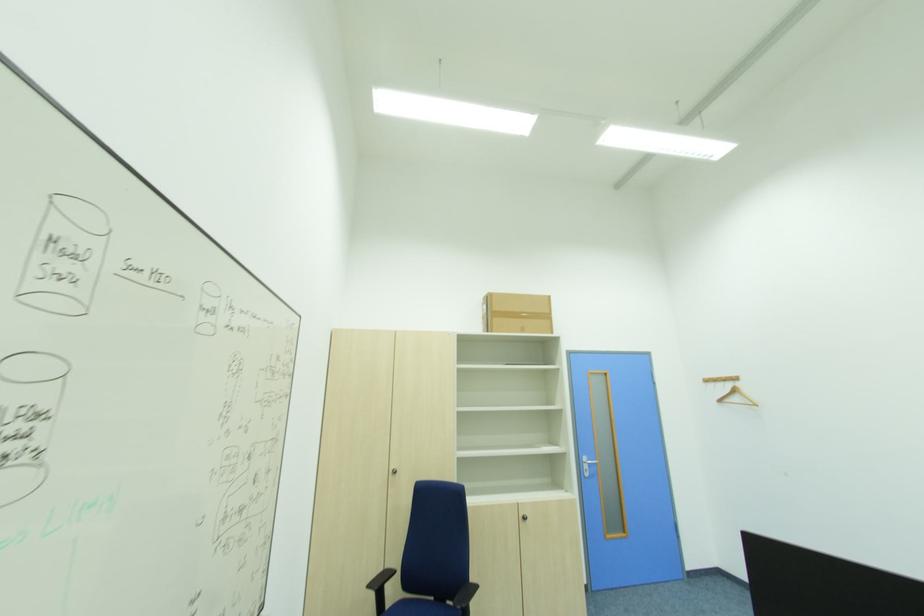
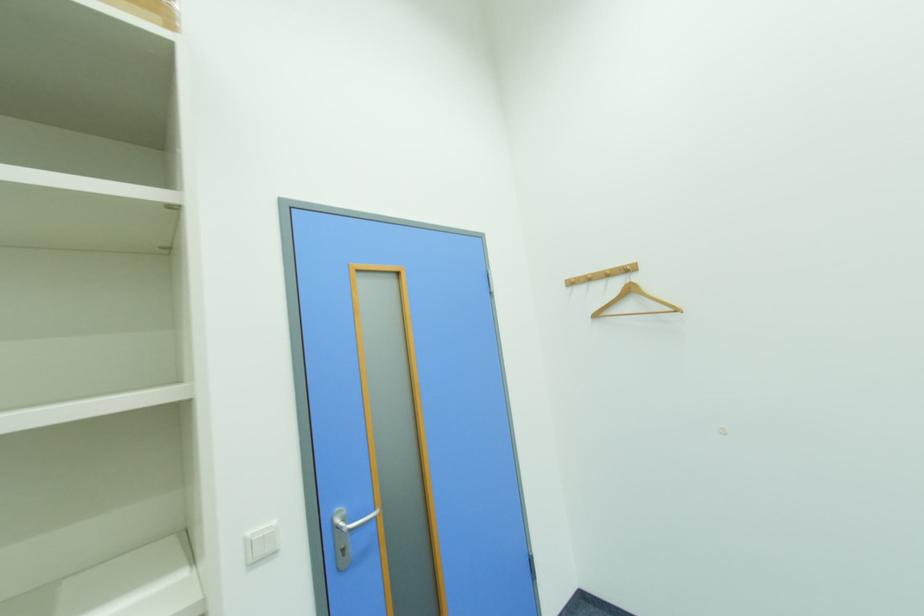
Where in the second image is the point corresponding to point 723,403 from the first image?

(601, 317)